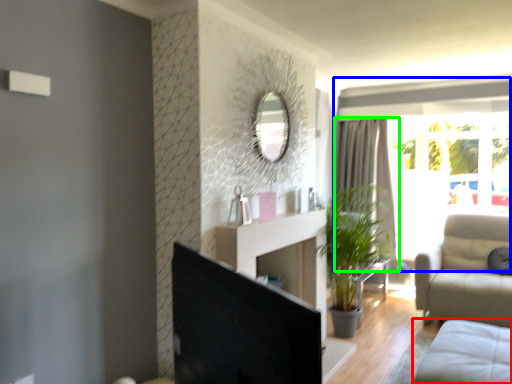
Question: Considering the real-world distances, which object is closest to studio couch (highlighted by a red box)? window (highlighted by a blue box) or curtain (highlighted by a green box).

Choices:
 (A) window
 (B) curtain

Answer: (A)